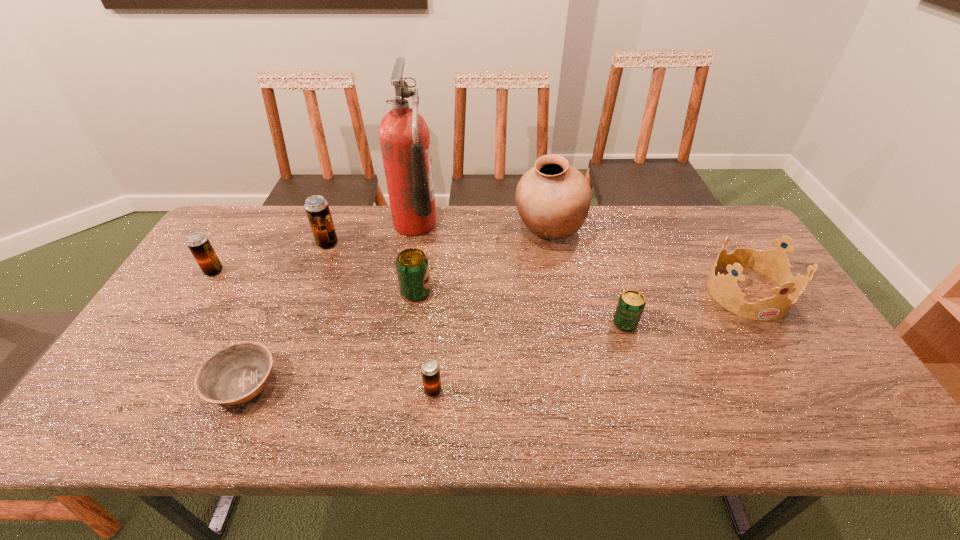
Locate an element on the screen. The image size is (960, 540). the left green beer can is located at coordinates (412, 267).

This screenshot has width=960, height=540. Identify the location of the smaller green beer can. (631, 303).

Find the location of a particular element. the fourth farthest beer can is located at coordinates (631, 303).

Locate an element on the screen. Image resolution: width=960 pixels, height=540 pixels. the smallest black beer can is located at coordinates (x=430, y=370).

The height and width of the screenshot is (540, 960). Find the location of `the fourth beer can from left to right`. the fourth beer can from left to right is located at coordinates (430, 370).

This screenshot has height=540, width=960. In order to click on bowl in this screenshot , I will do `click(235, 374)`.

Locate an element on the screen. The height and width of the screenshot is (540, 960). free space located on the front of the tallest object near the operation label is located at coordinates (467, 224).

Image resolution: width=960 pixels, height=540 pixels. Identify the location of blank space located 0.240m on the front of the pottery. (564, 310).

Image resolution: width=960 pixels, height=540 pixels. Find the location of `vacant space situated 0.250m on the right of the second black beer can from right to left`. vacant space situated 0.250m on the right of the second black beer can from right to left is located at coordinates (416, 244).

Where is `vacant space located on the front-facing side of the tiara`? Image resolution: width=960 pixels, height=540 pixels. vacant space located on the front-facing side of the tiara is located at coordinates (803, 382).